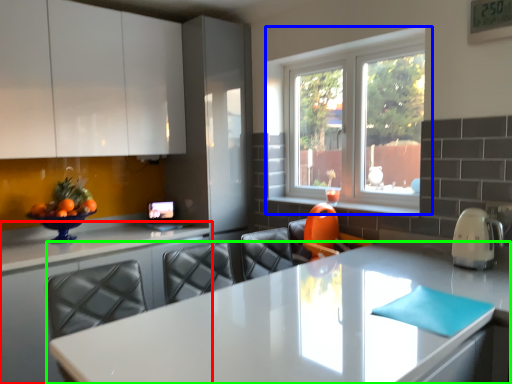
Question: Considering the real-world distances, which object is closest to countertop (highlighted by a red box)? window (highlighted by a blue box) or countertop (highlighted by a green box).

Choices:
 (A) window
 (B) countertop

Answer: (B)